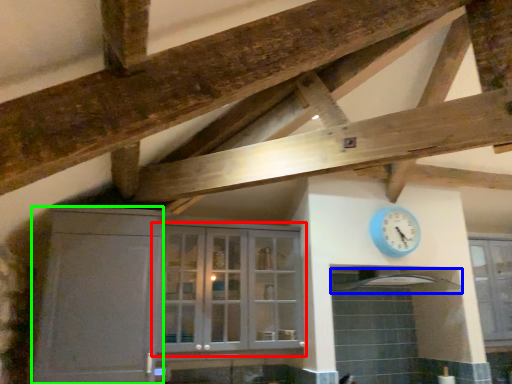
Question: Considering the real-world distances, which object is closest to cupboard (highlighted by a red box)? exhaust hood (highlighted by a blue box) or cabinetry (highlighted by a green box).

Choices:
 (A) exhaust hood
 (B) cabinetry

Answer: (B)